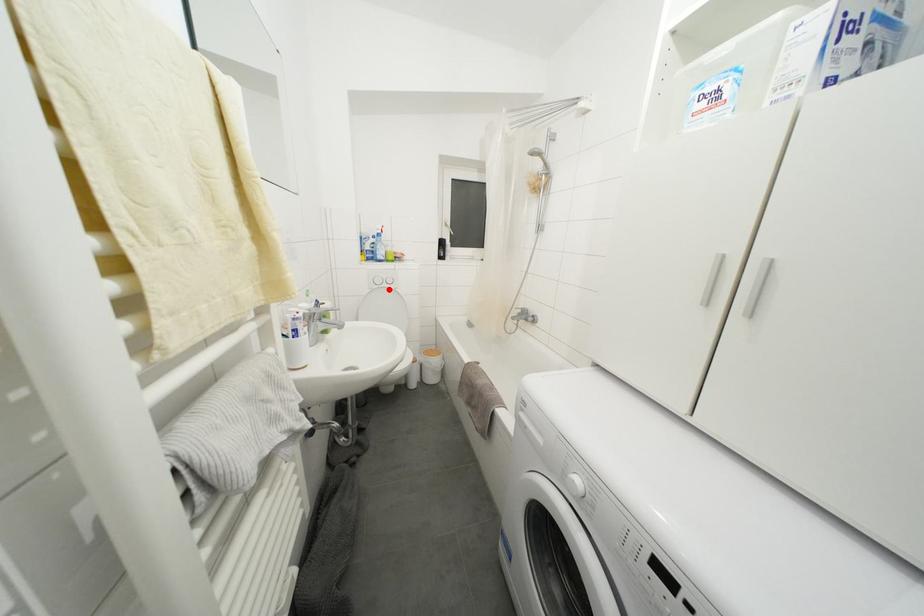
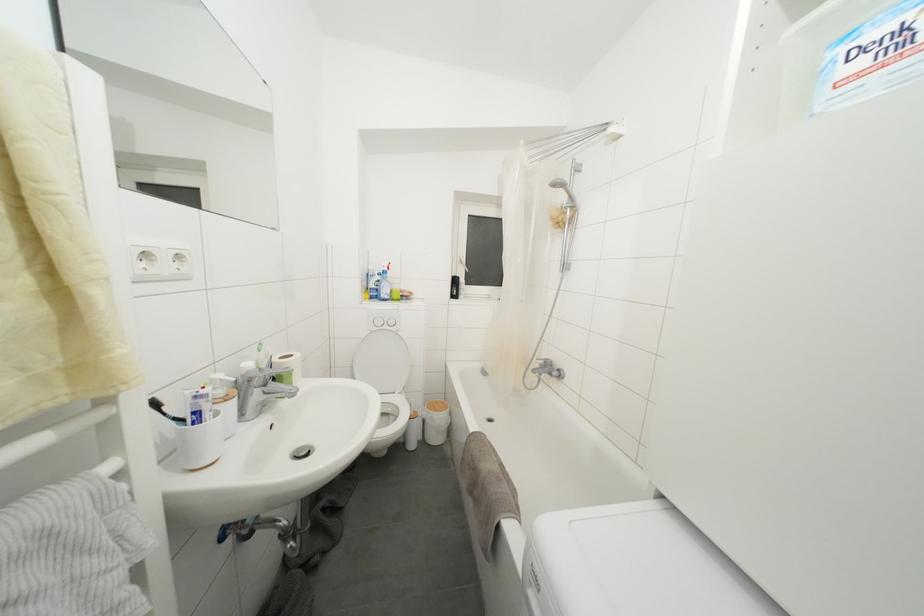
The point at the highlighted location is marked in the first image. Where is the corresponding point in the second image?

(390, 331)